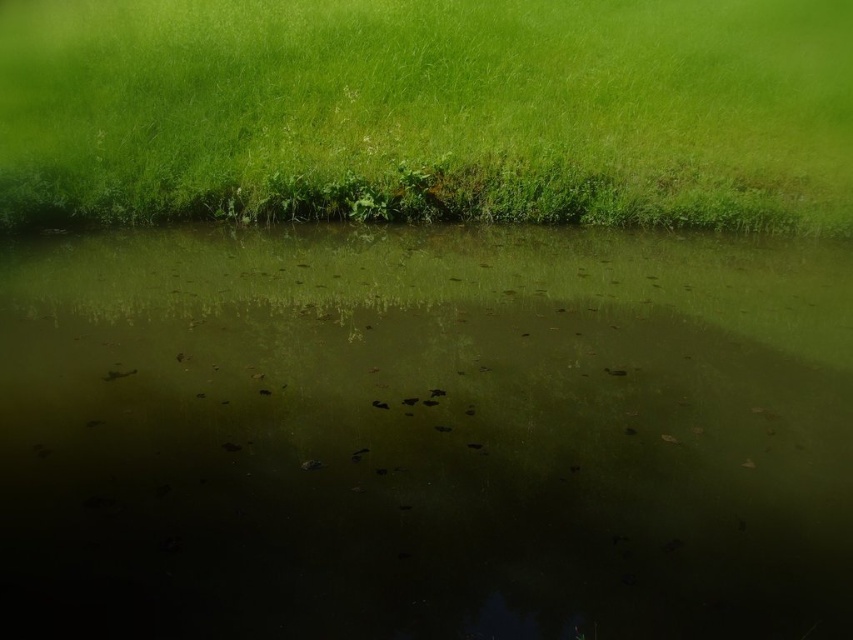
You are a landscape architect designing a new park. You observe the green murky water at center and the green grassy at upper center in the scene. Which area would you prioritize for expansion if you want to increase the overall green coverage in the park?

The green grassy at upper center occupies more space than the green murky water at center, so expanding the green grassy at upper center would be more effective in increasing the overall green coverage in the park.

You are standing at the edge of the water and want to place a small floating decoration exactly at the center of the green murky water at center. According to the coordinates provided, where should you place it?

You should place the small floating decoration at point (424,435), which is the exact location of the green murky water at center.